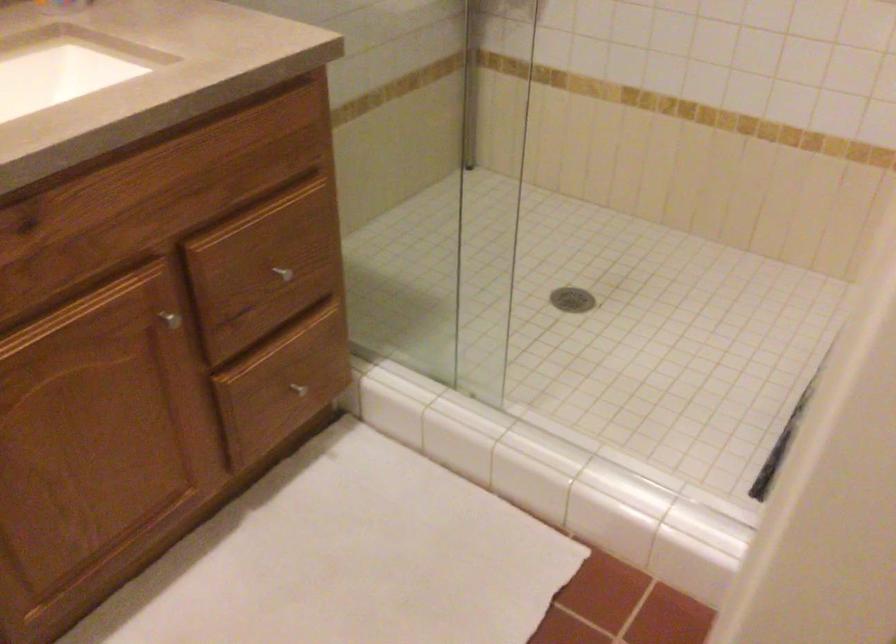
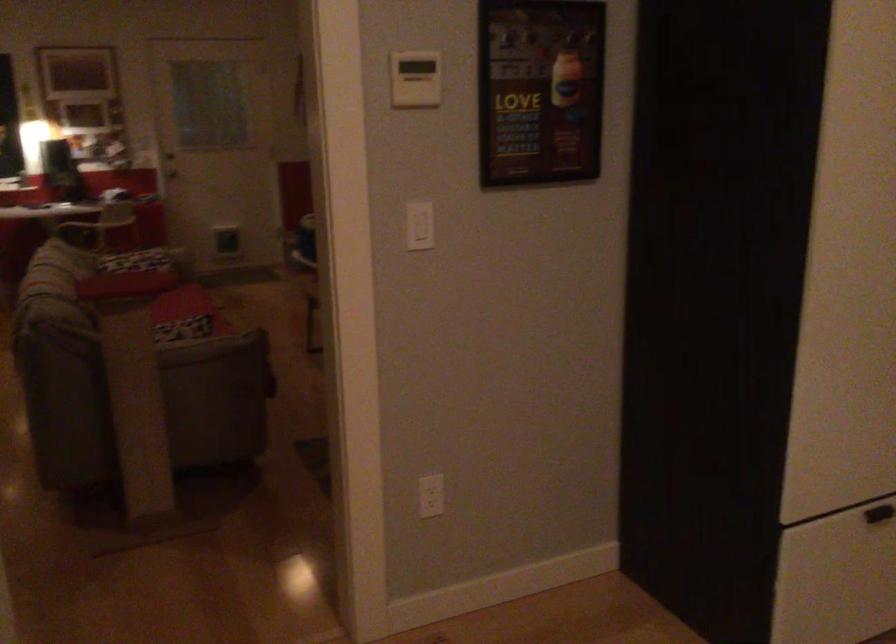
Question: The first image is from the beginning of the video and the second image is from the end. How did the camera likely rotate when shooting the video?

Choices:
 (A) Left
 (B) Right
 (C) Up
 (D) Down

Answer: (B)